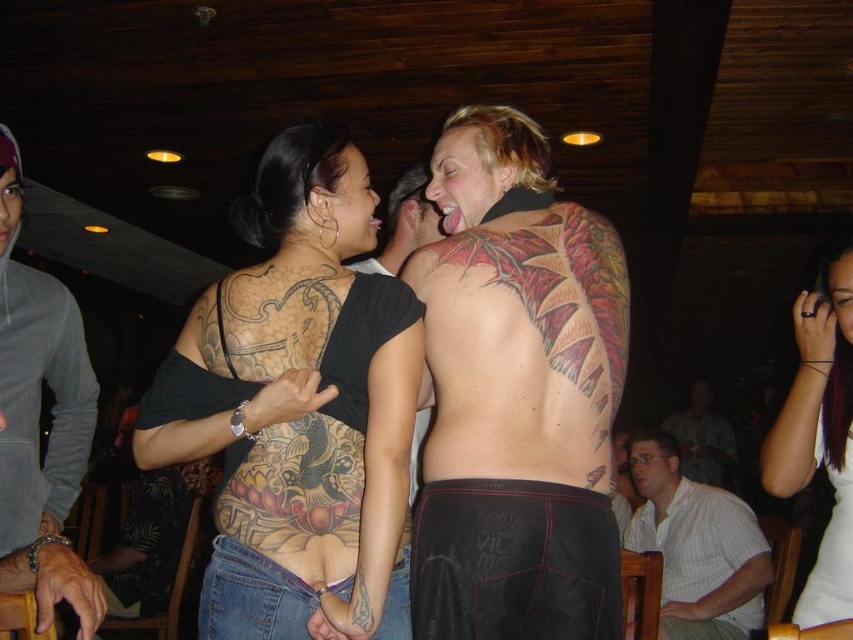
Question: Estimate the real-world distances between objects in this image. Which object is farther from the white striped shirt at lower right?

Choices:
 (A) matte black tank top at center
 (B) smooth skin tattoo at center
 (C) shiny metallic tattoo at center

Answer: (A)

Question: Can you confirm if black matte skin at center is smaller than matte black tank top at center?

Choices:
 (A) yes
 (B) no

Answer: (A)

Question: Which point is closer to the camera taking this photo?

Choices:
 (A) (407, 195)
 (B) (801, 612)

Answer: (B)

Question: Does white striped shirt at lower right come in front of shiny metallic tattoo at center?

Choices:
 (A) no
 (B) yes

Answer: (A)

Question: Which is farther from the smooth skin tattoo at center?

Choices:
 (A) dark brown skin tattoo at upper center
 (B) shiny metallic tattoo at center
 (C) shiny tattooed back at center
 (D) purple hair at upper right

Answer: (D)

Question: Can you confirm if shiny tattooed back at center is smaller than dark brown skin tattoo at upper center?

Choices:
 (A) no
 (B) yes

Answer: (A)